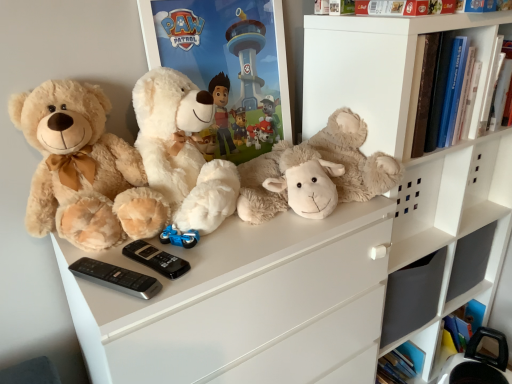
What do you see at coordinates (383, 70) in the screenshot? I see `white matte shelf at upper right` at bounding box center [383, 70].

What do you see at coordinates (75, 164) in the screenshot? The width and height of the screenshot is (512, 384). I see `soft beige teddy bear at left, arranged as the third teddy bear when viewed from the right` at bounding box center [75, 164].

What do you see at coordinates (116, 278) in the screenshot?
I see `black plastic remote at lower left, which ranks as the second control in back-to-front order` at bounding box center [116, 278].

I want to click on fluffy beige teddy bear at center, which appears as the third teddy bear when viewed from the left, so click(316, 173).

This screenshot has width=512, height=384. In order to click on white matte shelf at upper right in this screenshot , I will do `click(383, 70)`.

From the image's perspective, count 2nd controls downward from the white matte shelf at upper right and point to it. Please provide its 2D coordinates.

[(116, 278)]

Is white matte shelf at upper right wider or thinner than black plastic remote at lower left, which appears as the 1th control when viewed from the front?

Considering their sizes, white matte shelf at upper right looks broader than black plastic remote at lower left, which appears as the 1th control when viewed from the front.

How many degrees apart are the facing directions of white matte shelf at upper right and black plastic remote at lower left, which ranks as the second control in back-to-front order?

The angle between the facing direction of white matte shelf at upper right and the facing direction of black plastic remote at lower left, which ranks as the second control in back-to-front order, is 31.4 degrees.

Is white matte shelf at upper right situated inside black plastic remote at lower left, which appears as the 1th control when viewed from the front, or outside?

white matte shelf at upper right is spatially situated outside black plastic remote at lower left, which appears as the 1th control when viewed from the front.

From a real-world perspective, is hardcover book at upper right physically above fluffy white teddy bear at center, the second teddy bear in the right-to-left sequence?

Yes.

Considering the relative sizes of hardcover book at upper right and fluffy white teddy bear at center, acting as the 2th teddy bear starting from the left, in the image provided, is hardcover book at upper right thinner than fluffy white teddy bear at center, acting as the 2th teddy bear starting from the left,?

Indeed, hardcover book at upper right has a lesser width compared to fluffy white teddy bear at center, acting as the 2th teddy bear starting from the left.

In the image, is hardcover book at upper right positioned in front of or behind fluffy white teddy bear at center, acting as the 2th teddy bear starting from the left?

hardcover book at upper right is behind fluffy white teddy bear at center, acting as the 2th teddy bear starting from the left.

From the image's perspective, which object appears higher, hardcover book at upper right or fluffy white teddy bear at center, acting as the 2th teddy bear starting from the left?

hardcover book at upper right, from the image's perspective.

Which is more to the left, white matte shelf at upper right or soft beige teddy bear at left, the first teddy bear from the left?

soft beige teddy bear at left, the first teddy bear from the left, is more to the left.

How different are the orientations of white matte shelf at upper right and soft beige teddy bear at left, arranged as the third teddy bear when viewed from the right, in degrees?

They differ by 1.41 degrees in their facing directions.

This screenshot has width=512, height=384. Find the location of `the 3rd teddy bear to the left when counting from the white matte shelf at upper right`. the 3rd teddy bear to the left when counting from the white matte shelf at upper right is located at coordinates (75, 164).

From the image's perspective, between fluffy beige teddy bear at center, which appears as the third teddy bear when viewed from the left, and black plastic remote at lower left, which ranks as the second control in back-to-front order, which one is located above?

fluffy beige teddy bear at center, which appears as the third teddy bear when viewed from the left, from the image's perspective.

Considering the sizes of fluffy beige teddy bear at center, which appears as the third teddy bear when viewed from the left, and black plastic remote at lower left, which ranks as the second control in back-to-front order, in the image, is fluffy beige teddy bear at center, which appears as the third teddy bear when viewed from the left, taller or shorter than black plastic remote at lower left, which ranks as the second control in back-to-front order,?

Clearly, fluffy beige teddy bear at center, which appears as the third teddy bear when viewed from the left, is taller compared to black plastic remote at lower left, which ranks as the second control in back-to-front order.

Can you tell me how much fluffy beige teddy bear at center, which appears as the third teddy bear when viewed from the left, and black plastic remote at lower left, which ranks as the second control in back-to-front order, differ in facing direction?

30 degrees.

Could you tell me if fluffy beige teddy bear at center, which appears as the third teddy bear when viewed from the left, is turned towards black plastic remote at lower left, which appears as the 1th control when viewed from the front?

No, fluffy beige teddy bear at center, which appears as the third teddy bear when viewed from the left, is not oriented towards black plastic remote at lower left, which appears as the 1th control when viewed from the front.

Considering the sizes of objects hardcover book at upper right and white matte shelf at upper right in the image provided, who is shorter, hardcover book at upper right or white matte shelf at upper right?

Standing shorter between the two is white matte shelf at upper right.

Can you tell me how much hardcover book at upper right and white matte shelf at upper right differ in facing direction?

They differ by 0.488 degrees in their facing directions.

Considering the relative positions of hardcover book at upper right and white matte shelf at upper right in the image provided, is hardcover book at upper right behind white matte shelf at upper right?

Yes, the depth of hardcover book at upper right is greater than that of white matte shelf at upper right.

Is hardcover book at upper right far away from white matte shelf at upper right?

That's not correct — hardcover book at upper right is a little close to white matte shelf at upper right.

From the image's perspective, is hardcover book at upper right positioned above or below soft beige teddy bear at left, the first teddy bear from the left?

hardcover book at upper right is situated higher than soft beige teddy bear at left, the first teddy bear from the left, in the image.

Is the surface of hardcover book at upper right in direct contact with soft beige teddy bear at left, arranged as the third teddy bear when viewed from the right?

No, hardcover book at upper right is not with soft beige teddy bear at left, arranged as the third teddy bear when viewed from the right.

Which point is more forward, (421, 50) or (38, 177)?

The point (38, 177) is in front.

Where is `teddy bear that is the 2nd object directly below the hardcover book at upper right (from a real-world perspective)`? teddy bear that is the 2nd object directly below the hardcover book at upper right (from a real-world perspective) is located at coordinates (75, 164).

Considering the sizes of hardcover book at upper right and black plastic remote at center, arranged as the first control when viewed from the back, in the image, is hardcover book at upper right taller or shorter than black plastic remote at center, arranged as the first control when viewed from the back,?

In the image, hardcover book at upper right appears to be taller than black plastic remote at center, arranged as the first control when viewed from the back.

From the image's perspective, is hardcover book at upper right on top of black plastic remote at center, the 2th control positioned from the front?

Yes, from the image's perspective, hardcover book at upper right is above black plastic remote at center, the 2th control positioned from the front.

Which is nearer, [419,109] or [183,271]?

Clearly, point [419,109] is more distant from the camera than point [183,271].

Where is `shelf to the right of black plastic remote at lower left, which ranks as the second control in back-to-front order`? The width and height of the screenshot is (512, 384). shelf to the right of black plastic remote at lower left, which ranks as the second control in back-to-front order is located at coordinates [x=383, y=70].

Locate an element on the screen. This screenshot has height=384, width=512. book located above the fluffy white teddy bear at center, the second teddy bear in the right-to-left sequence (from the image's perspective) is located at coordinates (428, 92).

Estimate the real-world distances between objects in this image. Which object is further from fluffy beige teddy bear at center, which appears as the third teddy bear when viewed from the left, black plastic remote at center, the 2th control positioned from the front, or fluffy white teddy bear at center, acting as the 2th teddy bear starting from the left?

black plastic remote at center, the 2th control positioned from the front.

From the image, which object appears to be farther from black plastic remote at center, arranged as the first control when viewed from the back, black plastic remote at lower left, which ranks as the second control in back-to-front order, or fluffy beige teddy bear at center, which is counted as the 1th teddy bear, starting from the right?

The object further to black plastic remote at center, arranged as the first control when viewed from the back, is fluffy beige teddy bear at center, which is counted as the 1th teddy bear, starting from the right.

When comparing their distances from black plastic remote at center, the 2th control positioned from the front, does soft beige teddy bear at left, the first teddy bear from the left, or fluffy beige teddy bear at center, which is counted as the 1th teddy bear, starting from the right, seem closer?

soft beige teddy bear at left, the first teddy bear from the left, lies closer to black plastic remote at center, the 2th control positioned from the front, than the other object.

Considering their positions, is hardcover book at upper right positioned further to fluffy white teddy bear at center, the second teddy bear in the right-to-left sequence, than white matte shelf at upper right?

hardcover book at upper right.

Based on the photo, considering their positions, is white matte shelf at upper right positioned closer to black plastic remote at center, arranged as the first control when viewed from the back, than fluffy beige teddy bear at center, which is counted as the 1th teddy bear, starting from the right?

Based on the image, fluffy beige teddy bear at center, which is counted as the 1th teddy bear, starting from the right, appears to be nearer to black plastic remote at center, arranged as the first control when viewed from the back.

Looking at the image, which one is located closer to fluffy beige teddy bear at center, which is counted as the 1th teddy bear, starting from the right, fluffy white teddy bear at center, acting as the 2th teddy bear starting from the left, or soft beige teddy bear at left, the first teddy bear from the left?

Among the two, fluffy white teddy bear at center, acting as the 2th teddy bear starting from the left, is located nearer to fluffy beige teddy bear at center, which is counted as the 1th teddy bear, starting from the right.

From the image, which object appears to be nearer to soft beige teddy bear at left, arranged as the third teddy bear when viewed from the right, black plastic remote at lower left, which ranks as the second control in back-to-front order, or black plastic remote at center, the 2th control positioned from the front?

black plastic remote at center, the 2th control positioned from the front.

From the image, which object appears to be farther from black plastic remote at center, the 2th control positioned from the front, black plastic remote at lower left, which ranks as the second control in back-to-front order, or hardcover book at upper right?

hardcover book at upper right is positioned further to the anchor black plastic remote at center, the 2th control positioned from the front.

You are a GUI agent. You are given a task and a screenshot of the screen. Output one action in this format:
    pyautogui.click(x=<x>, y=<y>)
    Task: Click on the teddy bear between soft beige teddy bear at left, the first teddy bear from the left, and fluffy beige teddy bear at center, which appears as the third teddy bear when viewed from the left, in the horizontal direction
    Image resolution: width=512 pixels, height=384 pixels.
    Given the screenshot: What is the action you would take?
    pyautogui.click(x=164, y=148)

Where is `control between fluffy white teddy bear at center, the second teddy bear in the right-to-left sequence, and black plastic remote at lower left, which appears as the 1th control when viewed from the front, from top to bottom`? The height and width of the screenshot is (384, 512). control between fluffy white teddy bear at center, the second teddy bear in the right-to-left sequence, and black plastic remote at lower left, which appears as the 1th control when viewed from the front, from top to bottom is located at coordinates (156, 259).

Find the location of `shelf between soft beige teddy bear at left, the first teddy bear from the left, and hardcover book at upper right, in the horizontal direction`. shelf between soft beige teddy bear at left, the first teddy bear from the left, and hardcover book at upper right, in the horizontal direction is located at coordinates (383, 70).

The image size is (512, 384). I want to click on control located between black plastic remote at lower left, which appears as the 1th control when viewed from the front, and hardcover book at upper right in the left-right direction, so click(156, 259).